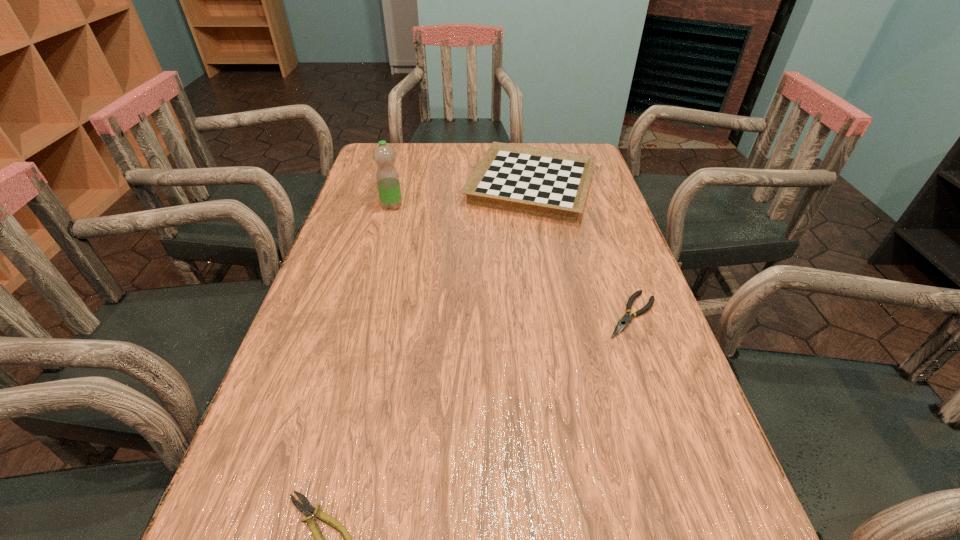
I want to click on the tallest object, so click(387, 177).

At what (x,y) coordinates should I click in order to perform the action: click on checkerboard. Please return your answer as a coordinate pair (x, y). The image size is (960, 540). Looking at the image, I should click on (553, 184).

Identify the location of the taller pliers. (623, 322).

Find the location of `the second nearest object`. the second nearest object is located at coordinates (623, 322).

Find the location of a particular element. The image size is (960, 540). vacant region located 0.370m on the front of the water bottle is located at coordinates (365, 308).

Locate an element on the screen. Image resolution: width=960 pixels, height=540 pixels. vacant region located on the front of the checkerboard is located at coordinates (548, 286).

Locate an element on the screen. The width and height of the screenshot is (960, 540). vacant point located 0.170m on the back of the second nearest object is located at coordinates (608, 246).

Identify the location of object at the far edge. This screenshot has height=540, width=960. (553, 184).

This screenshot has width=960, height=540. Find the location of `object present at the left edge`. object present at the left edge is located at coordinates (387, 177).

Where is `checkerboard located in the right edge section of the desktop`? The height and width of the screenshot is (540, 960). checkerboard located in the right edge section of the desktop is located at coordinates (553, 184).